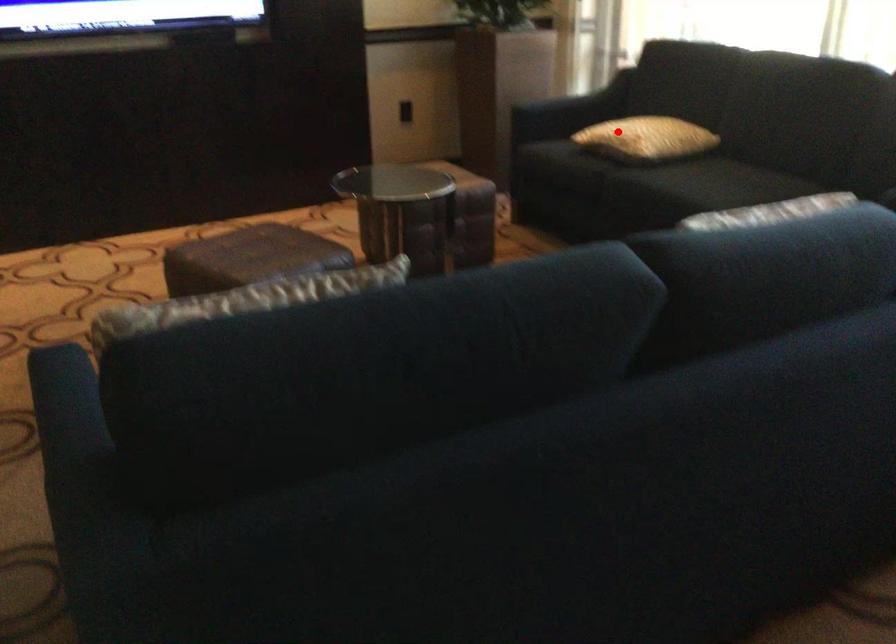
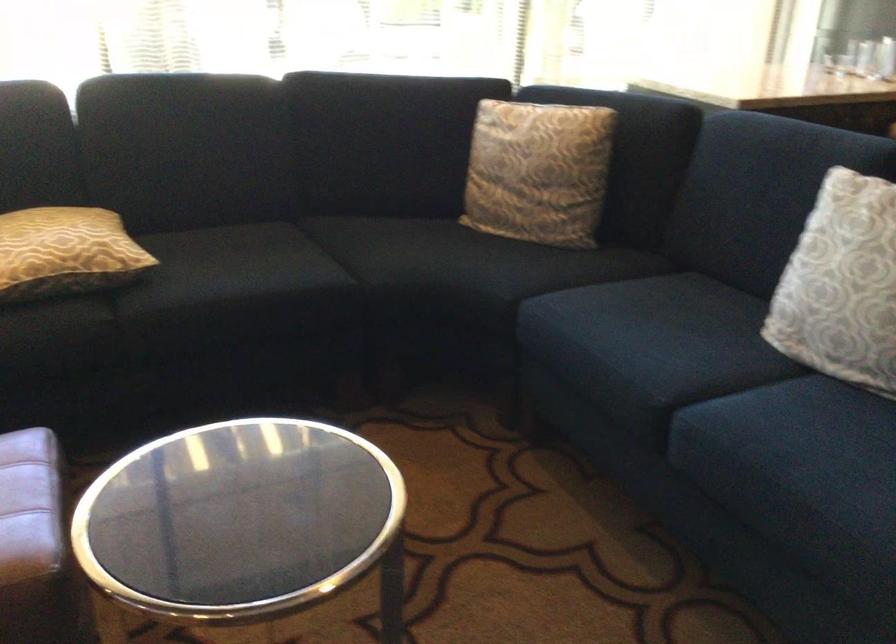
Question: I am providing you with two images of the same scene from different viewpoints. In image1, a red point is highlighted. Considering the same 3D point in image2, which of the following is correct?

Choices:
 (A) It is closer
 (B) It is farther

Answer: (A)